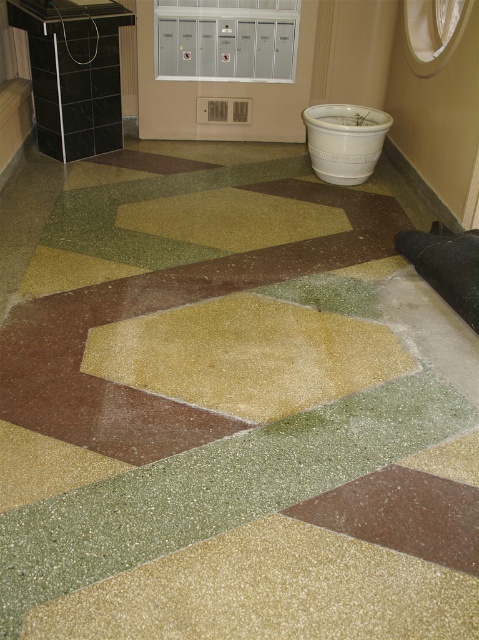
The image size is (479, 640). Describe the element at coordinates (247, 355) in the screenshot. I see `shiny gold hexagon at center` at that location.

Can you confirm if shiny gold hexagon at center is smaller than brown speckled tile at center?

No.

Between point (360, 362) and point (402, 525), which one is positioned behind?

Positioned behind is point (360, 362).

Identify the location of shiny gold hexagon at center. (247, 355).

Does brown speckled tile at center come behind white ceramic pot at center?

No, it is not.

Between brown speckled tile at center and white ceramic pot at center, which one has more height?

Standing taller between the two is white ceramic pot at center.

Is point (475, 536) farther from camera compared to point (356, 122)?

That is False.

Image resolution: width=479 pixels, height=640 pixels. What are the coordinates of `brown speckled tile at center` in the screenshot? It's located at (402, 515).

How far apart are shiny gold hexagon at center and white ceramic pot at center?

The distance of shiny gold hexagon at center from white ceramic pot at center is 5.90 feet.

Does shiny gold hexagon at center have a greater height compared to white ceramic pot at center?

No, shiny gold hexagon at center is not taller than white ceramic pot at center.

Is point (216, 339) closer to camera compared to point (387, 131)?

Yes, it is in front of point (387, 131).

The image size is (479, 640). I want to click on shiny gold hexagon at center, so click(247, 355).